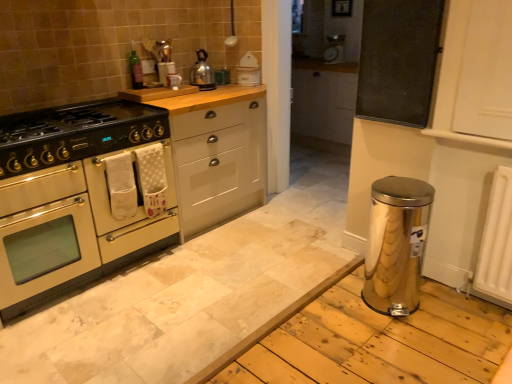
Question: Does white plastic toaster at upper center appear on the right side of metallic mesh board at upper right?

Choices:
 (A) yes
 (B) no

Answer: (B)

Question: From a real-world perspective, is white plastic toaster at upper center physically below metallic mesh board at upper right?

Choices:
 (A) no
 (B) yes

Answer: (B)

Question: From the image's perspective, is white plastic toaster at upper center located beneath metallic mesh board at upper right?

Choices:
 (A) no
 (B) yes

Answer: (A)

Question: Is white plastic toaster at upper center surrounding metallic mesh board at upper right?

Choices:
 (A) yes
 (B) no

Answer: (B)

Question: Is white plastic toaster at upper center beside metallic mesh board at upper right?

Choices:
 (A) yes
 (B) no

Answer: (B)

Question: Considering the relative sizes of white plastic toaster at upper center and metallic mesh board at upper right in the image provided, is white plastic toaster at upper center taller than metallic mesh board at upper right?

Choices:
 (A) yes
 (B) no

Answer: (B)

Question: Does polished stainless steel kettle at upper center turn towards metallic mesh board at upper right?

Choices:
 (A) no
 (B) yes

Answer: (B)

Question: Is polished stainless steel kettle at upper center next to metallic mesh board at upper right?

Choices:
 (A) yes
 (B) no

Answer: (B)

Question: Can you confirm if polished stainless steel kettle at upper center is shorter than metallic mesh board at upper right?

Choices:
 (A) no
 (B) yes

Answer: (B)

Question: Does polished stainless steel kettle at upper center have a smaller size compared to metallic mesh board at upper right?

Choices:
 (A) yes
 (B) no

Answer: (A)

Question: From a real-world perspective, is polished stainless steel kettle at upper center physically above metallic mesh board at upper right?

Choices:
 (A) yes
 (B) no

Answer: (B)

Question: From the image's perspective, is polished stainless steel kettle at upper center below metallic mesh board at upper right?

Choices:
 (A) no
 (B) yes

Answer: (A)

Question: Are white matte cabinet at center, which is counted as the 1th cabinetry, starting from the right, and green glass bottle at upper center making contact?

Choices:
 (A) no
 (B) yes

Answer: (A)